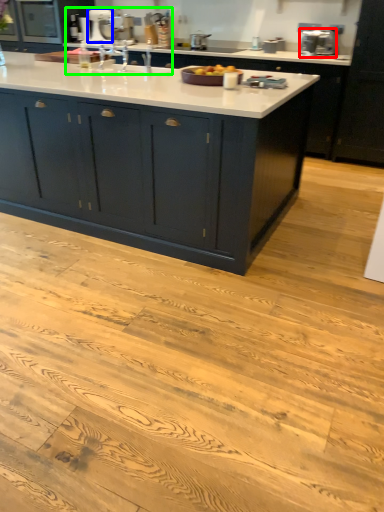
Question: Based on their relative distances, which object is farther from appliance (highlighted by a red box)? Choose from appliance (highlighted by a blue box) and sink (highlighted by a green box).

Choices:
 (A) appliance
 (B) sink

Answer: (A)